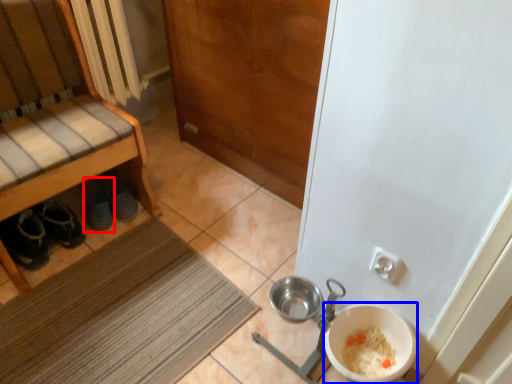
Question: Which object is further to the camera taking this photo, footwear (highlighted by a red box) or basin (highlighted by a blue box)?

Choices:
 (A) footwear
 (B) basin

Answer: (A)